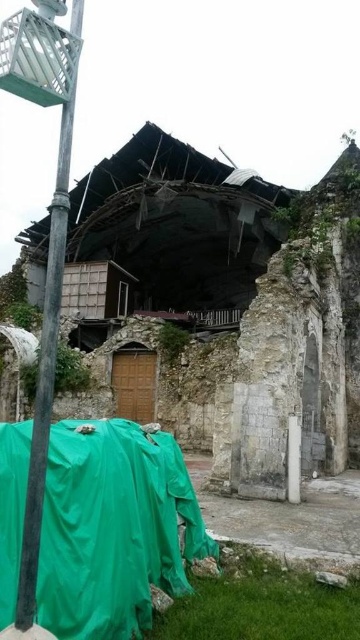
You are a rescue worker trying to navigate through the disaster area. You see the green tarpaulin at lower left and the metallic pole at left. Which object is positioned to the right when viewed from your perspective?

The green tarpaulin at lower left is positioned to the right of the metallic pole at left.

You are a rescue worker carrying a stretcher that is 2.5 meters long. You need to move through the area between the green tarpaulin at lower left and the metallic pole at left. Can you pass through this space with the stretcher?

The distance between the green tarpaulin at lower left and the metallic pole at left is 2.73 meters. Since the stretcher is 2.5 meters long, it can fit through the space as there is enough clearance.

You are a rescue worker trying to locate survivors in the collapsed building. You have two points marked on your map as potential entry points. The first is at point [176,582] and the second is at point [70,113]. Which point is closer to you, the rescue worker, as you approach the building?

Point [70,113] is closer to you because it is less further to the viewer than point [176,582].